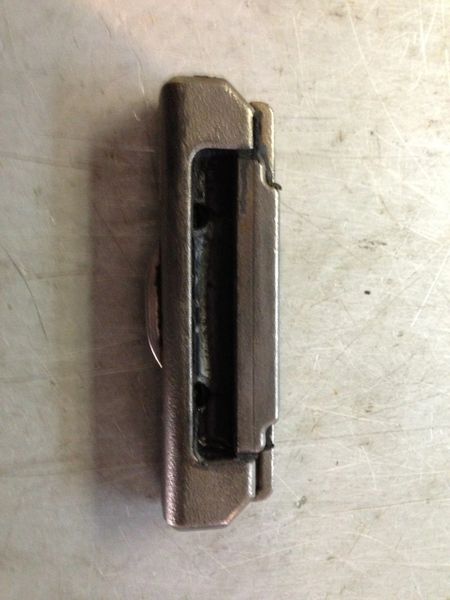
Where is `metal table or floor`? metal table or floor is located at coordinates (75, 272), (71, 394), (346, 538), (340, 205), (365, 296), (362, 117), (127, 76).